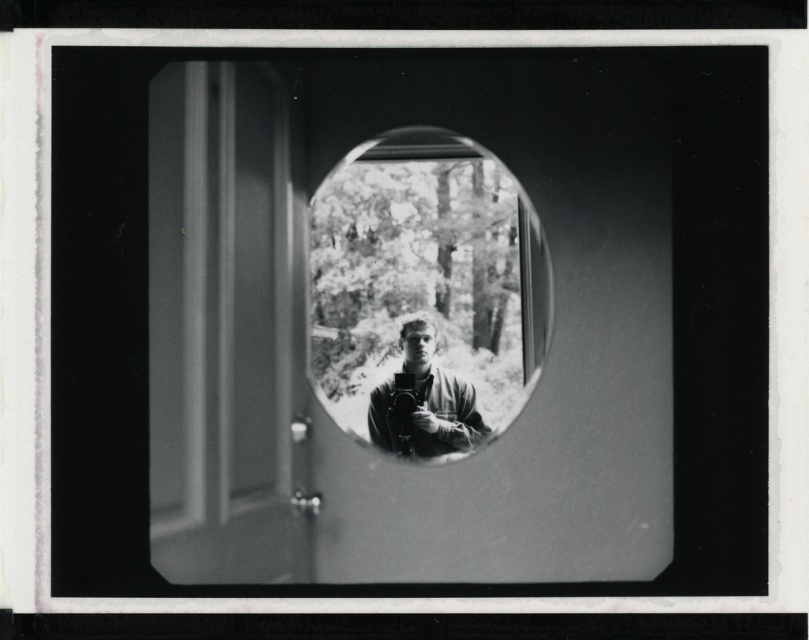
You are looking through the circular window in the door and see two points marked on the image. Based on their positions, which point is closer to you, point (375, 392) or point (414, 321)?

Point (375, 392) is closer to the viewer than point (414, 321).

You are an architect analyzing the placement of the smooth glass mirror at center in the door design. Based on the coordinates provided, is the mirror positioned closer to the top or bottom of the door?

The smooth glass mirror at center is positioned closer to the bottom of the door since its coordinates are at point 0.461 on the x and 0.525 on the y. Since the y coordinate is closer to 0.5, which is the center, but since the bottom is at 0, the mirror is closer to the bottom than the top.

You are trying to determine which object in the scene is bigger. You see a smooth glass mirror at center and a smooth black camera at center. Which one is larger?

The smooth glass mirror at center is larger than the smooth black camera at center.